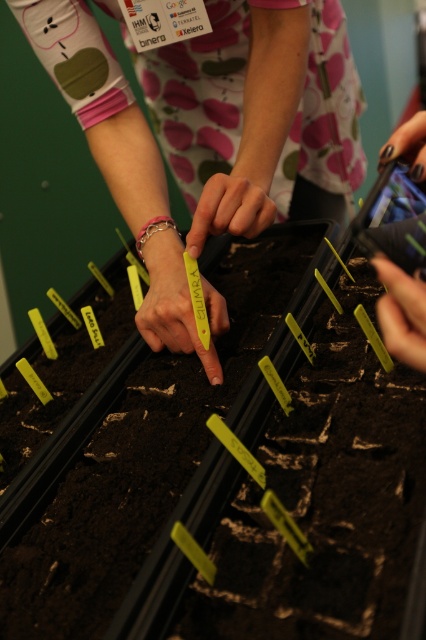
Who is more forward, (x=328, y=202) or (x=167, y=330)?

Point (x=167, y=330)

The width and height of the screenshot is (426, 640). Describe the element at coordinates (256, 113) in the screenshot. I see `yellow paper tag at center` at that location.

Locate an element on the screen. The image size is (426, 640). yellow paper tag at center is located at coordinates (256, 113).

Is smooth yellow tag at center thinner than yellow paper at right?

In fact, smooth yellow tag at center might be wider than yellow paper at right.

Is the position of smooth yellow tag at center less distant than that of yellow paper at right?

That is False.

What do you see at coordinates (232, 205) in the screenshot? I see `smooth yellow tag at center` at bounding box center [232, 205].

The width and height of the screenshot is (426, 640). Find the location of `smooth yellow tag at center`. smooth yellow tag at center is located at coordinates (232, 205).

Between yellow plastic tag at center and smooth yellow tag at center, which one has less height?

Standing shorter between the two is yellow plastic tag at center.

Who is taller, yellow plastic tag at center or smooth yellow tag at center?

Standing taller between the two is smooth yellow tag at center.

Between point (187, 337) and point (273, 204), which one is positioned behind?

The point (187, 337) is more distant.

This screenshot has width=426, height=640. I want to click on yellow plastic tag at center, so click(172, 305).